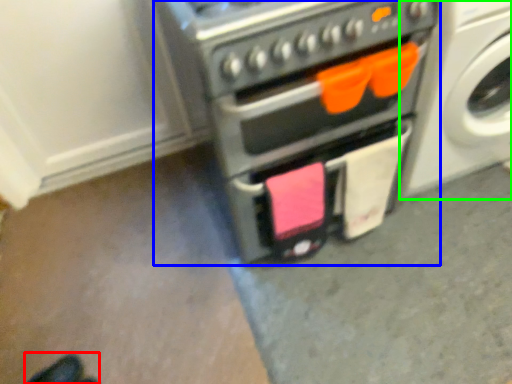
Question: Estimate the real-world distances between objects in this image. Which object is farther from footwear (highlighted by a red box), home appliance (highlighted by a blue box) or washing machine (highlighted by a green box)?

Choices:
 (A) home appliance
 (B) washing machine

Answer: (B)